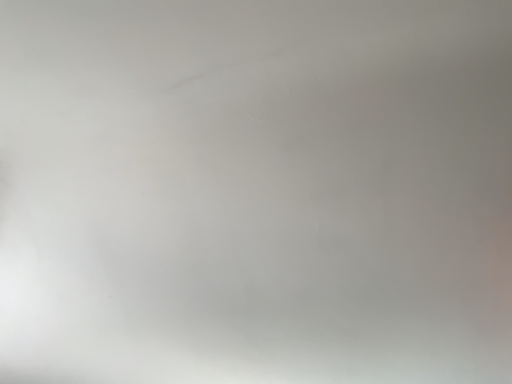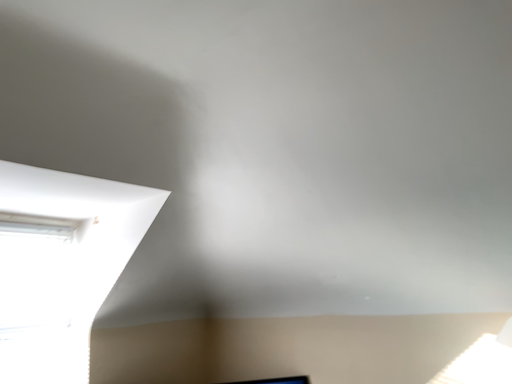
Question: How did the camera likely rotate when shooting the video?

Choices:
 (A) rotated downward
 (B) rotated upward

Answer: (A)